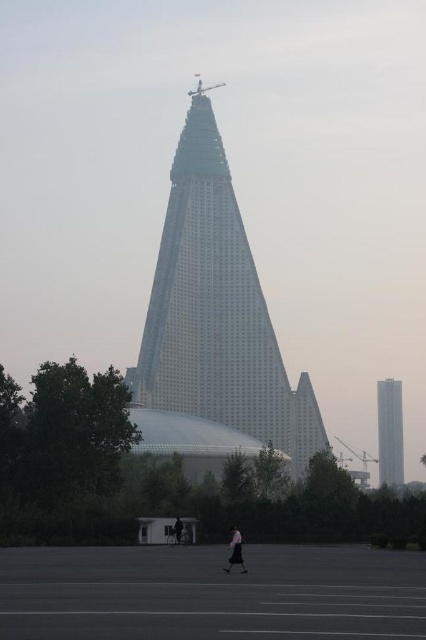
You are standing at the center of the image and want to find the white glass tower at right. In which direction should you look to see it?

The white glass tower at right is located at the right side of the image, so you should look to your right to see it.

You are standing at the point marked by the coordinates (216,314) in the image. Looking around, you see the Ryugyong Hotel and the paved area with people. Which direction should you face to see the silver metallic pyramid at center?

You should face the center direction because the silver metallic pyramid at center is located at the point marked by the coordinates (216,314), which is your current position. Facing the center will align you with the pyramid.

You are standing in front of the Ryugyong Hotel and want to take a photo. You notice two points marked on the pavement in front of you. The first point is at coordinate point (x=379, y=472), and the second is at coordinate point (x=175, y=516). Which point is closer to you?

Point (x=379, y=472) is further to the viewer than point (x=175, y=516), so the closer point to you is point (x=175, y=516).